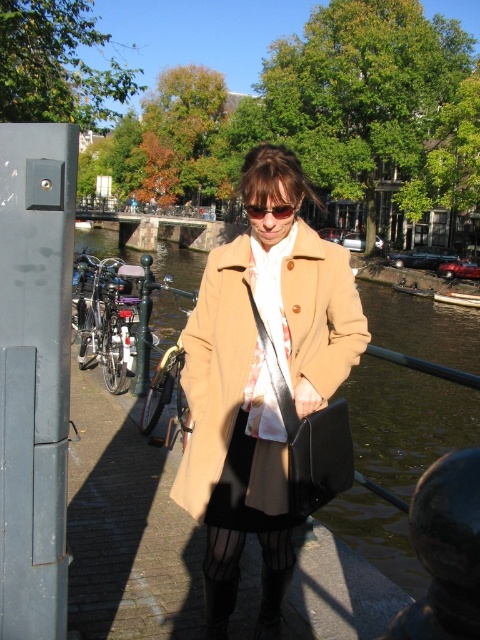
Does beige wool coat at center have a larger size compared to clear plastic goggles at center?

Incorrect, beige wool coat at center is not larger than clear plastic goggles at center.

Between beige wool coat at center and clear plastic goggles at center, which one appears on the right side from the viewer's perspective?

Positioned to the right is beige wool coat at center.

Where is `beige wool coat at center`? beige wool coat at center is located at coordinates (260, 381).

Image resolution: width=480 pixels, height=640 pixels. Find the location of `beige wool coat at center`. beige wool coat at center is located at coordinates (260, 381).

From the picture: Can you confirm if clear water at center is positioned above clear plastic goggles at center?

Correct, clear water at center is located above clear plastic goggles at center.

Is clear water at center to the right of clear plastic goggles at center from the viewer's perspective?

Yes, clear water at center is to the right of clear plastic goggles at center.

I want to click on clear water at center, so click(x=406, y=420).

I want to click on beige wool coat at center, so click(x=260, y=381).

Between beige wool coat at center and clear water at center, which one appears on the left side from the viewer's perspective?

Positioned to the left is beige wool coat at center.

Find the location of a particular element. Image resolution: width=480 pixels, height=640 pixels. beige wool coat at center is located at coordinates (260, 381).